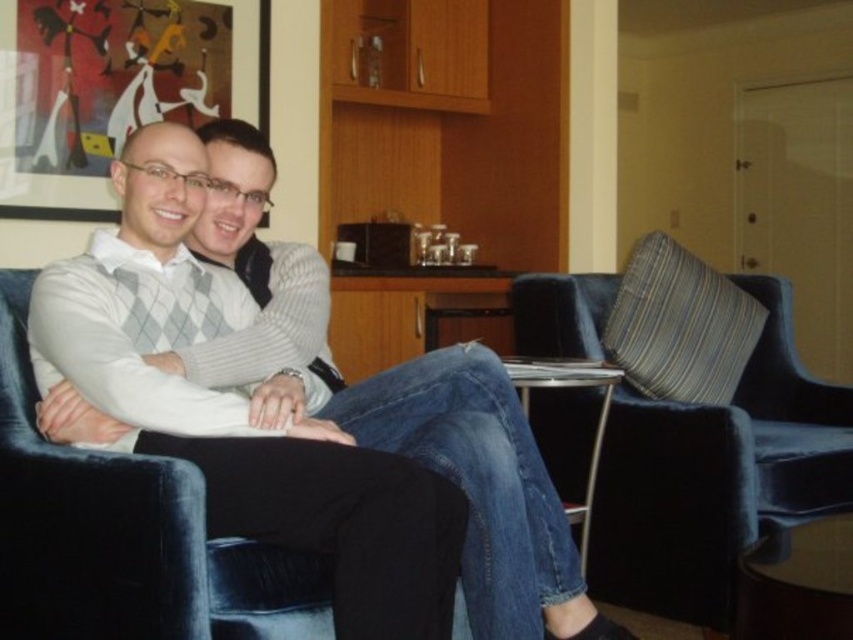
You are standing in the living room and want to place a decorative vase that is 3 feet tall on the point at coordinate (123,324). Considering the distance from you to that point is 5.19 feet, will the vase be visible to someone standing at your current position?

The distance of point (123,324) from viewer is 5.19 feet. Since the vase is 3 feet tall, it will be visible as long as there are no obstructions between you and the point. The height of the vase is less than the distance, so visibility depends on clearance.

Looking at this image, you are a delivery person trying to place a small package between the white sweater at center and the velvet blue armchair at right. Can you fit the package there?

The white sweater at center might be wider than velvet blue armchair at right, so there might not be enough space to fit the package between them.